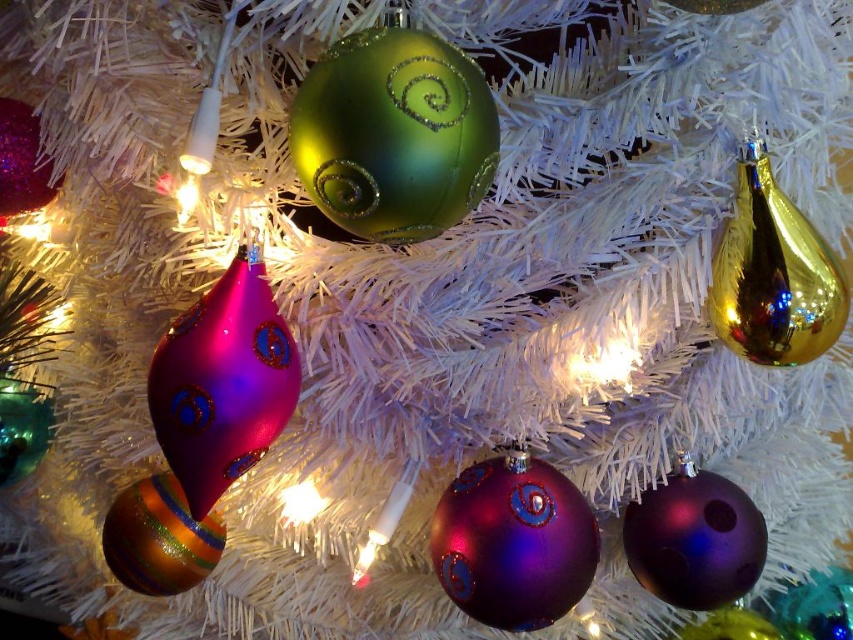
Find the location of a particular element. matte purple ball at center is located at coordinates (514, 541).

Based on the photo, is matte purple ball at center to the right of gold reflective teardrop at right from the viewer's perspective?

In fact, matte purple ball at center is to the left of gold reflective teardrop at right.

Between point (465, 493) and point (834, 337), which one is positioned in front?

Point (834, 337) is more forward.

The width and height of the screenshot is (853, 640). In order to click on matte purple ball at center in this screenshot , I will do `click(514, 541)`.

Is green glossy ornament at upper center to the right of gold reflective teardrop at right from the viewer's perspective?

Incorrect, green glossy ornament at upper center is not on the right side of gold reflective teardrop at right.

Between point (468, 96) and point (749, 344), which one is positioned behind?

The point (749, 344) is behind.

Which is in front, point (409, 122) or point (770, 321)?

Point (409, 122)

The image size is (853, 640). What are the coordinates of `green glossy ornament at upper center` in the screenshot? It's located at (393, 134).

Does green glossy ornament at upper center have a smaller size compared to matte purple ball at center?

Yes.

Is the position of green glossy ornament at upper center more distant than that of matte purple ball at center?

No, it is in front of matte purple ball at center.

Does point (390, 29) come farther from viewer compared to point (566, 547)?

No, (390, 29) is in front of (566, 547).

The image size is (853, 640). Identify the location of green glossy ornament at upper center. (393, 134).